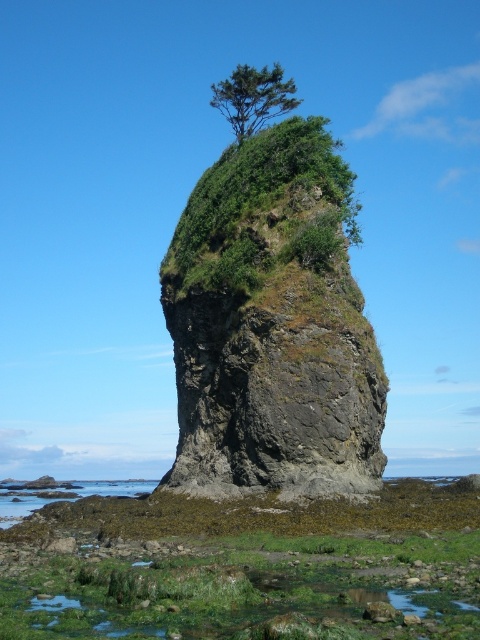
Does green mossy rock at center have a smaller size compared to green leafy tree at upper center?

Correct, green mossy rock at center occupies less space than green leafy tree at upper center.

Between green mossy rock at center and green leafy tree at upper center, which one is positioned higher?

green leafy tree at upper center

Identify the location of green mossy rock at center. The width and height of the screenshot is (480, 640). (272, 324).

Between point (290, 301) and point (231, 170), which one is positioned behind?

The point (231, 170) is more distant.

What do you see at coordinates (272, 324) in the screenshot? The height and width of the screenshot is (640, 480). I see `green mossy rock at center` at bounding box center [272, 324].

At what (x,y) coordinates should I click in order to perform the action: click on green mossy rock at center. Please return your answer as a coordinate pair (x, y). Image resolution: width=480 pixels, height=640 pixels. Looking at the image, I should click on (272, 324).

Is green leafy vegetation at center behind green leafy tree at upper center?

No, green leafy vegetation at center is in front of green leafy tree at upper center.

Which is below, green leafy vegetation at center or green leafy tree at upper center?

Positioned lower is green leafy vegetation at center.

Which is in front, point (311, 122) or point (247, 108)?

Point (311, 122)

The width and height of the screenshot is (480, 640). Find the location of `green leafy vegetation at center`. green leafy vegetation at center is located at coordinates click(x=261, y=186).